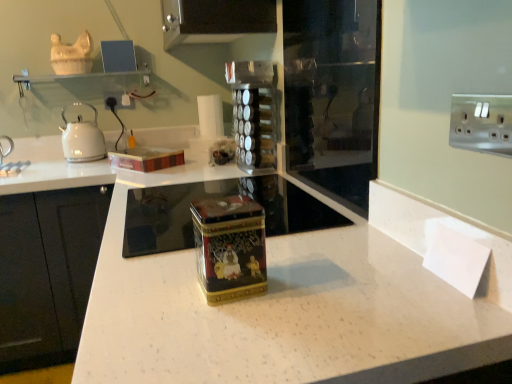
Question: Should I look upward or downward to see white speckled granite at center?

Choices:
 (A) up
 (B) down

Answer: (B)

Question: From a real-world perspective, does clear plastic spice rack at center stand above white speckled granite at center?

Choices:
 (A) yes
 (B) no

Answer: (A)

Question: Is the position of clear plastic spice rack at center more distant than that of white speckled granite at center?

Choices:
 (A) yes
 (B) no

Answer: (A)

Question: Does clear plastic spice rack at center appear on the right side of white speckled granite at center?

Choices:
 (A) no
 (B) yes

Answer: (B)

Question: Can you confirm if clear plastic spice rack at center is thinner than white speckled granite at center?

Choices:
 (A) no
 (B) yes

Answer: (B)

Question: Is clear plastic spice rack at center positioned with its back to white speckled granite at center?

Choices:
 (A) yes
 (B) no

Answer: (B)

Question: Considering the relative sizes of clear plastic spice rack at center and white speckled granite at center in the image provided, is clear plastic spice rack at center wider than white speckled granite at center?

Choices:
 (A) no
 (B) yes

Answer: (A)

Question: Does white glossy kettle at left appear on the right side of white speckled granite at center?

Choices:
 (A) no
 (B) yes

Answer: (A)

Question: Is white glossy kettle at left looking in the opposite direction of white speckled granite at center?

Choices:
 (A) yes
 (B) no

Answer: (B)

Question: From a real-world perspective, is white glossy kettle at left on top of white speckled granite at center?

Choices:
 (A) yes
 (B) no

Answer: (A)

Question: From the image's perspective, does white glossy kettle at left appear higher than white speckled granite at center?

Choices:
 (A) no
 (B) yes

Answer: (B)

Question: Does white glossy kettle at left have a greater width compared to white speckled granite at center?

Choices:
 (A) yes
 (B) no

Answer: (B)

Question: Is the depth of white glossy kettle at left less than that of white speckled granite at center?

Choices:
 (A) no
 (B) yes

Answer: (A)

Question: Is clear plastic spice rack at center at the right side of white plastic electric outlet at upper right?

Choices:
 (A) no
 (B) yes

Answer: (B)